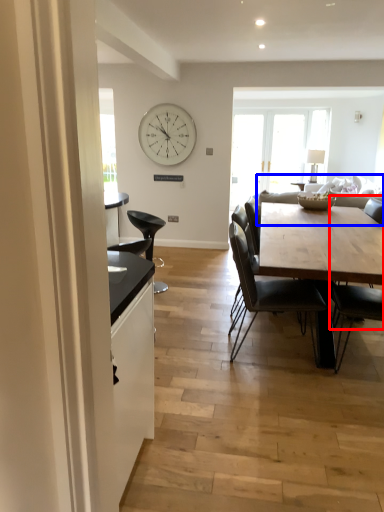
Question: Which point is further to the camera, chair (highlighted by a red box) or couch (highlighted by a blue box)?

Choices:
 (A) chair
 (B) couch

Answer: (B)